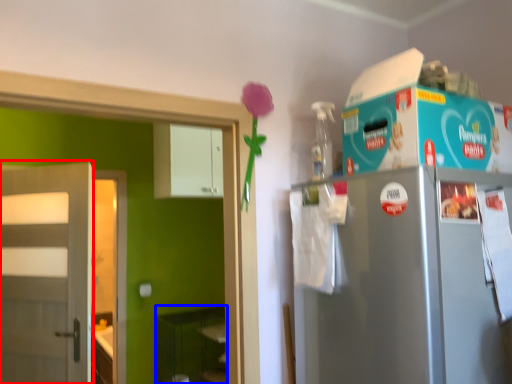
Question: Which object is closer to the camera taking this photo, door (highlighted by a red box) or shelf (highlighted by a blue box)?

Choices:
 (A) door
 (B) shelf

Answer: (A)